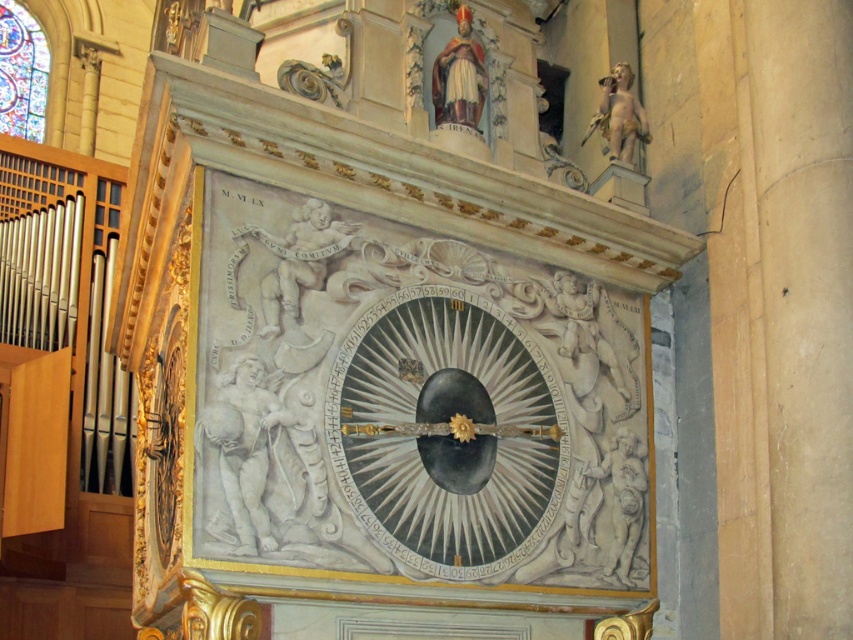
Question: Can you confirm if stained glass at upper left is thinner than white marble cherub at upper right?

Choices:
 (A) no
 (B) yes

Answer: (A)

Question: Which point is closer to the camera?

Choices:
 (A) (581, 140)
 (B) (456, 477)
 (C) (463, 51)

Answer: (B)

Question: Is black polished wood clock at center smaller than white marble cherub at upper right?

Choices:
 (A) yes
 (B) no

Answer: (A)

Question: Among these objects, which one is farthest from the camera?

Choices:
 (A) polychrome stone statue at upper center
 (B) white marble cherub at upper right
 (C) black polished wood clock at center
 (D) stained glass at upper left

Answer: (D)

Question: Which object appears farthest from the camera in this image?

Choices:
 (A) black polished wood clock at center
 (B) stained glass at upper left
 (C) white marble cherub at upper right
 (D) polychrome stone statue at upper center

Answer: (B)

Question: Is stained glass at upper left closer to the viewer compared to white marble cherub at upper right?

Choices:
 (A) yes
 (B) no

Answer: (B)